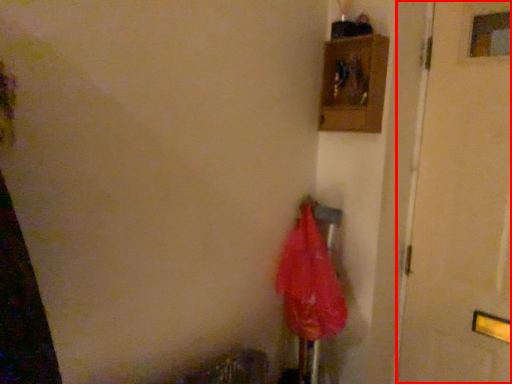
Question: Observing the image, what is the correct spatial positioning of door (annotated by the red box) in reference to umbrella?

Choices:
 (A) left
 (B) right

Answer: (B)